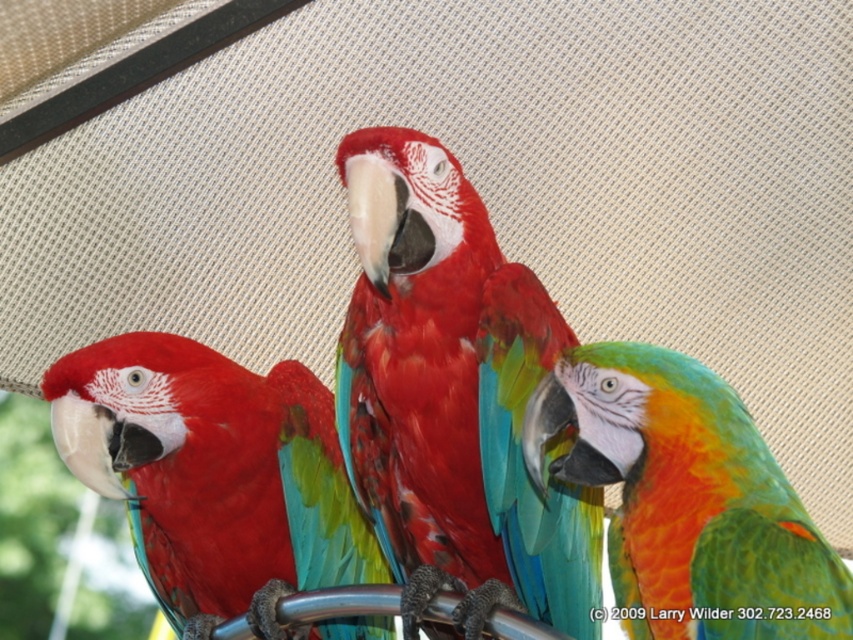
Question: Can you confirm if matte red parrot at left is wider than multicolored feathered parrot at center?

Choices:
 (A) yes
 (B) no

Answer: (A)

Question: Among these objects, which one is nearest to the camera?

Choices:
 (A) matte red parrot at left
 (B) multicolored feathered parrot at center
 (C) shiny red parrot at center

Answer: (B)

Question: Is shiny red parrot at center below matte red parrot at left?

Choices:
 (A) no
 (B) yes

Answer: (A)

Question: Which point is closer to the camera?

Choices:
 (A) multicolored feathered parrot at center
 (B) shiny red parrot at center

Answer: (A)

Question: Which point is closer to the camera taking this photo?

Choices:
 (A) (357, 540)
 (B) (685, 579)

Answer: (B)

Question: Can you confirm if shiny red parrot at center is smaller than matte red parrot at left?

Choices:
 (A) no
 (B) yes

Answer: (A)